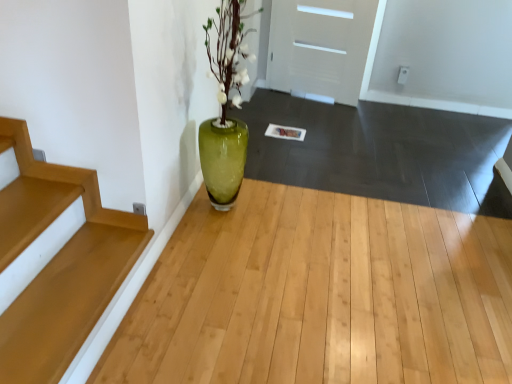
Question: Does wooden stairs at lower left appear on the left side of green glass vase at center?

Choices:
 (A) no
 (B) yes

Answer: (B)

Question: From a real-world perspective, is wooden stairs at lower left over green glass vase at center?

Choices:
 (A) yes
 (B) no

Answer: (A)

Question: Is wooden stairs at lower left located outside green glass vase at center?

Choices:
 (A) no
 (B) yes

Answer: (B)

Question: Can you confirm if wooden stairs at lower left is taller than green glass vase at center?

Choices:
 (A) yes
 (B) no

Answer: (A)

Question: Is the depth of wooden stairs at lower left less than that of green glass vase at center?

Choices:
 (A) yes
 (B) no

Answer: (B)

Question: Is wooden stairs at lower left beside green glass vase at center?

Choices:
 (A) yes
 (B) no

Answer: (B)

Question: Is white matte door at upper center positioned far away from wooden stairs at lower left?

Choices:
 (A) yes
 (B) no

Answer: (A)

Question: Does white matte door at upper center have a greater height compared to wooden stairs at lower left?

Choices:
 (A) no
 (B) yes

Answer: (B)

Question: Is white matte door at upper center shorter than wooden stairs at lower left?

Choices:
 (A) no
 (B) yes

Answer: (A)

Question: Can you confirm if white matte door at upper center is thinner than wooden stairs at lower left?

Choices:
 (A) no
 (B) yes

Answer: (B)

Question: Is white matte door at upper center oriented away from wooden stairs at lower left?

Choices:
 (A) yes
 (B) no

Answer: (B)

Question: Could you tell me if white matte door at upper center is turned towards wooden stairs at lower left?

Choices:
 (A) no
 (B) yes

Answer: (B)

Question: Is white matte door at upper center placed right next to green glass vase at center?

Choices:
 (A) no
 (B) yes

Answer: (A)